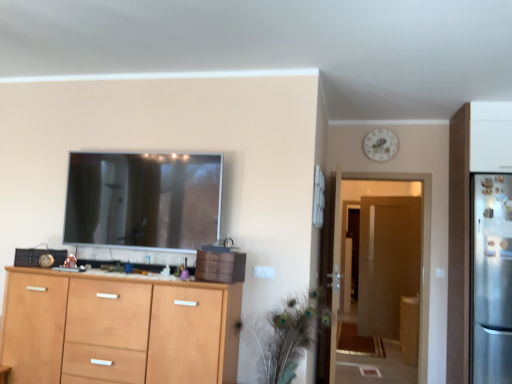
In order to face satin silver refrigerator at right, should I rotate leftwards or rightwards?

To align with it, rotate right about 29.168°.

I want to click on satin silver refrigerator at right, so click(490, 278).

What do you see at coordinates (118, 277) in the screenshot?
I see `wooden cabinet at center` at bounding box center [118, 277].

Describe the element at coordinates (409, 328) in the screenshot. I see `wooden cabinet at right, the first cabinetry viewed from the back` at that location.

What do you see at coordinates (380, 145) in the screenshot? The image size is (512, 384). I see `white glossy clock at upper center` at bounding box center [380, 145].

What do you see at coordinates (421, 248) in the screenshot? I see `transparent glass door at center` at bounding box center [421, 248].

At what (x,y) coordinates should I click in order to perform the action: click on satin silver refrigerator at right. Please return your answer as a coordinate pair (x, y). The image size is (512, 384). Looking at the image, I should click on (490, 278).

From the image's perspective, between light wood cabinet at lower left, which is counted as the 2th cabinetry, starting from the right, and white glossy clock at upper center, who is located below?

light wood cabinet at lower left, which is counted as the 2th cabinetry, starting from the right, from the image's perspective.

Which is closer, (139, 307) or (381, 139)?

Point (139, 307)

Where is `cabinetry on the left of white glossy clock at upper center`? The height and width of the screenshot is (384, 512). cabinetry on the left of white glossy clock at upper center is located at coordinates (117, 329).

Which is in front, light wood cabinet at lower left, the 1th cabinetry from the front, or white glossy clock at upper center?

light wood cabinet at lower left, the 1th cabinetry from the front, is in front.

From their relative heights in the image, would you say brown matte drawer at center is taller or shorter than wooden cabinet at center?

In the image, brown matte drawer at center appears to be taller than wooden cabinet at center.

What's the angular difference between brown matte drawer at center and wooden cabinet at center's facing directions?

brown matte drawer at center and wooden cabinet at center are facing 12.8 degrees away from each other.

Which is in front, point (225, 265) or point (181, 286)?

The point (181, 286) is more forward.

Based on the photo, from a real-world perspective, between brown matte drawer at center and wooden cabinet at center, who is vertically higher?

brown matte drawer at center is physically above.

Can you confirm if satin silver refrigerator at right is smaller than light wood cabinet at lower left, which ranks as the second cabinetry in bottom-to-top order?

Indeed, satin silver refrigerator at right has a smaller size compared to light wood cabinet at lower left, which ranks as the second cabinetry in bottom-to-top order.

Is point (509, 297) more distant than point (117, 361)?

Yes, point (509, 297) is behind point (117, 361).

In the scene shown: How many degrees apart are the facing directions of satin silver refrigerator at right and light wood cabinet at lower left, marked as the first cabinetry in a top-to-bottom arrangement?

The angle between the facing direction of satin silver refrigerator at right and the facing direction of light wood cabinet at lower left, marked as the first cabinetry in a top-to-bottom arrangement, is 0.00012 degrees.

Where is `cabinetry that is the 1st one when counting downward from the satin silver refrigerator at right (from the image's perspective)`? cabinetry that is the 1st one when counting downward from the satin silver refrigerator at right (from the image's perspective) is located at coordinates (117, 329).

Which object is thinner, wooden cabinet at right, the second cabinetry positioned from the front, or white glossy clock at upper center?

With smaller width is white glossy clock at upper center.

Consider the image. From a real-world perspective, who is located higher, wooden cabinet at right, which is the second cabinetry from top to bottom, or white glossy clock at upper center?

In real-world perspective, white glossy clock at upper center is above.

Does wooden cabinet at right, the 1th cabinetry when ordered from right to left, lie behind white glossy clock at upper center?

Yes, it is behind white glossy clock at upper center.

Is point (403, 320) in front of point (380, 156)?

No, (403, 320) is further to viewer.

Can you confirm if brown matte drawer at center is positioned to the left of transparent glass door at center?

Correct, you'll find brown matte drawer at center to the left of transparent glass door at center.

Is brown matte drawer at center oriented towards transparent glass door at center?

No, brown matte drawer at center is not turned towards transparent glass door at center.

Is brown matte drawer at center further to camera compared to transparent glass door at center?

No, it is in front of transparent glass door at center.

The width and height of the screenshot is (512, 384). I want to click on clock on the right of light wood cabinet at lower left, the 2th cabinetry in the back-to-front sequence, so [x=380, y=145].

Between white glossy clock at upper center and light wood cabinet at lower left, which ranks as the second cabinetry in bottom-to-top order, which one is positioned behind?

white glossy clock at upper center.

Is white glossy clock at upper center not inside light wood cabinet at lower left, marked as the first cabinetry in a top-to-bottom arrangement?

Absolutely, white glossy clock at upper center is external to light wood cabinet at lower left, marked as the first cabinetry in a top-to-bottom arrangement.

Which object is positioned more to the left, brown matte drawer at center or white glossy clock at upper center?

brown matte drawer at center is more to the left.

Between brown matte drawer at center and white glossy clock at upper center, which one has smaller width?

white glossy clock at upper center.

From the image's perspective, between brown matte drawer at center and white glossy clock at upper center, who is located below?

brown matte drawer at center appears lower in the image.

Find the location of `drawer that is below the white glossy clock at upper center (from the image's perspective)`. drawer that is below the white glossy clock at upper center (from the image's perspective) is located at coordinates (220, 266).

Identify the location of cabinetry that is on the left side of white glossy clock at upper center. (117, 329).

The height and width of the screenshot is (384, 512). I want to click on drawer in front of the wooden cabinet at center, so click(x=220, y=266).

From the image, which object appears to be nearer to green feathered plant at center, brown matte drawer at center or satin silver refrigerator at right?

The object closer to green feathered plant at center is brown matte drawer at center.

Estimate the real-world distances between objects in this image. Which object is further from wooden cabinet at right, the 1th cabinetry when ordered from right to left, green feathered plant at center or wooden cabinet at center?

Based on the image, wooden cabinet at center appears to be further to wooden cabinet at right, the 1th cabinetry when ordered from right to left.

Considering their positions, is brown wooden door at center positioned closer to satin silver refrigerator at right than wooden cabinet at right, the first cabinetry viewed from the back?

wooden cabinet at right, the first cabinetry viewed from the back.

Which object lies nearer to the anchor point light wood cabinet at lower left, marked as the 1th cabinetry in a left-to-right arrangement, wooden cabinet at right, the first cabinetry viewed from the back, or wooden cabinet at center?

Based on the image, wooden cabinet at center appears to be nearer to light wood cabinet at lower left, marked as the 1th cabinetry in a left-to-right arrangement.

Looking at the image, which one is located closer to white glossy clock at upper center, light wood cabinet at lower left, which ranks as the second cabinetry in bottom-to-top order, or brown matte drawer at center?

brown matte drawer at center is closer to white glossy clock at upper center.

Which object lies nearer to the anchor point satin silver refrigerator at right, transparent glass door at center or wooden cabinet at right, the second cabinetry positioned from the front?

transparent glass door at center is closer to satin silver refrigerator at right.

Based on their spatial positions, is transparent glass door at center or white glossy clock at upper center further from satin silver refrigerator at right?

Based on the image, white glossy clock at upper center appears to be further to satin silver refrigerator at right.

Which object lies further to the anchor point green feathered plant at center, transparent glass door at center or brown wooden door at center?

brown wooden door at center lies further to green feathered plant at center than the other object.

At what (x,y) coordinates should I click in order to perform the action: click on cabinetry positioned between green feathered plant at center and brown wooden door at center from near to far. Please return your answer as a coordinate pair (x, y). Looking at the image, I should click on (409, 328).

Find the location of a particular element. The height and width of the screenshot is (384, 512). clock located between light wood cabinet at lower left, which ranks as the second cabinetry in bottom-to-top order, and satin silver refrigerator at right in the left-right direction is located at coordinates (380, 145).

Where is `clock located between wooden cabinet at center and wooden cabinet at right, the second cabinetry positioned from the front, in the left-right direction`? clock located between wooden cabinet at center and wooden cabinet at right, the second cabinetry positioned from the front, in the left-right direction is located at coordinates click(x=380, y=145).

The image size is (512, 384). I want to click on clock between brown matte drawer at center and satin silver refrigerator at right from left to right, so click(380, 145).